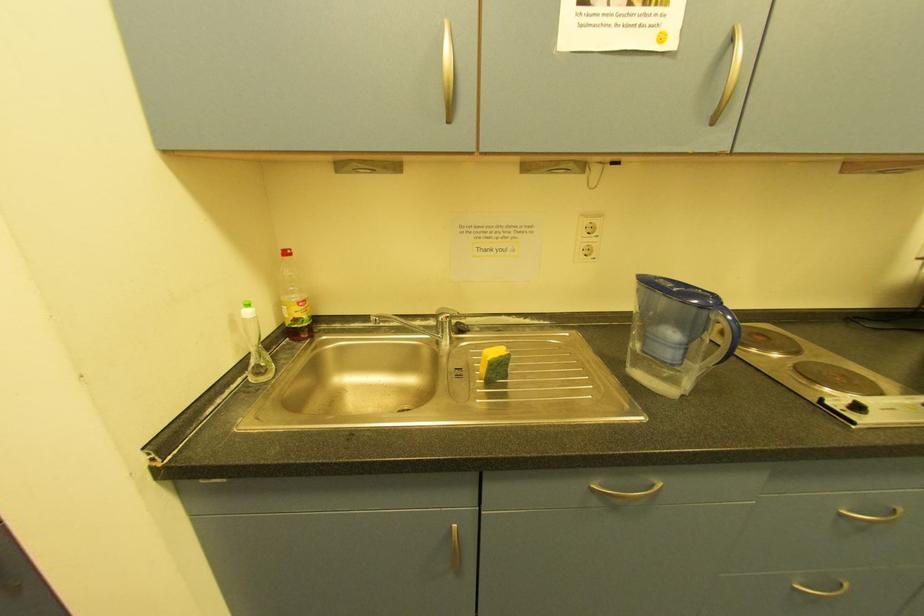
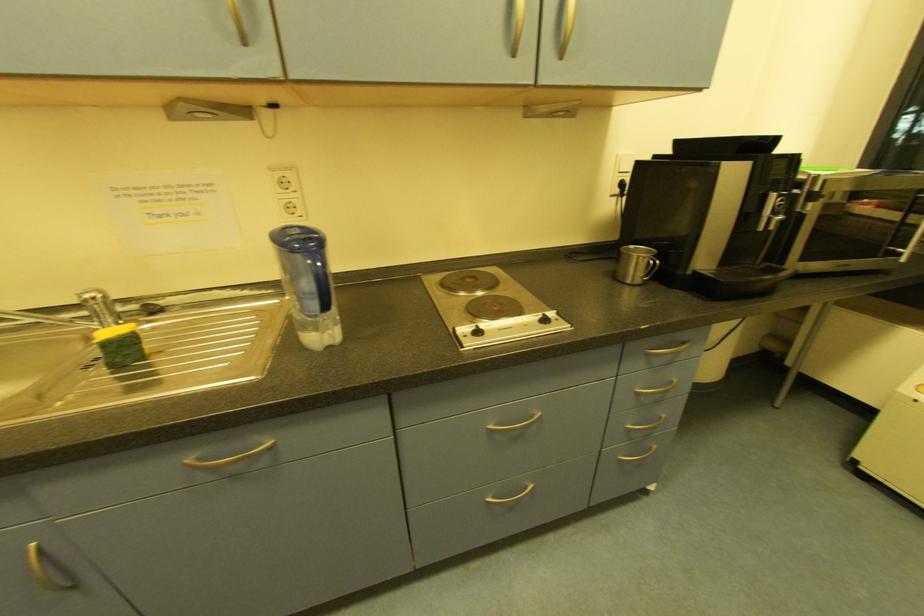
Question: The images are taken continuously from a first-person perspective. In which direction are you moving?

Choices:
 (A) Left
 (B) Right
 (C) Forward
 (D) Backward

Answer: (B)